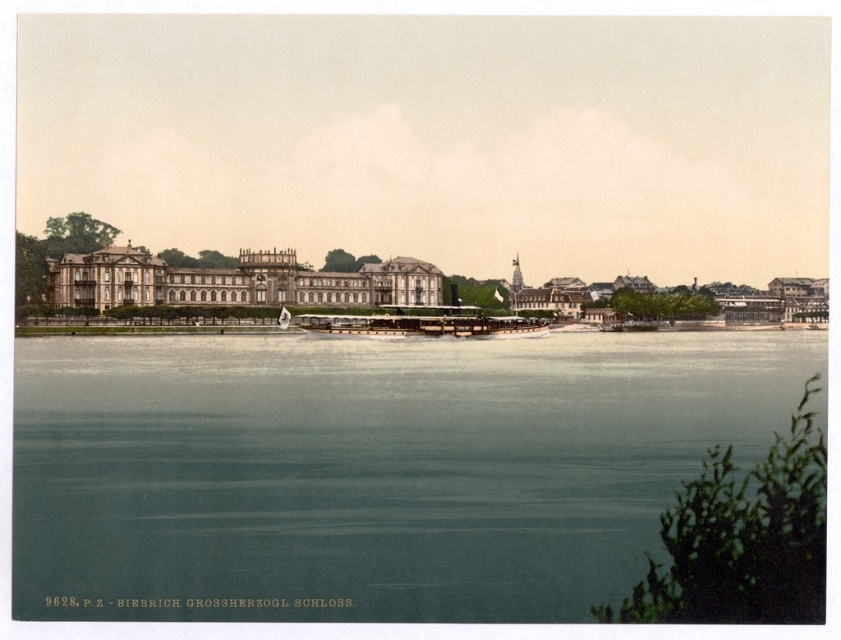
Is beige stone palace at center further to the viewer compared to wooden polished boat at center?

No, beige stone palace at center is in front of wooden polished boat at center.

How far apart are beige stone palace at center and wooden polished boat at center?

A distance of 10.85 meters exists between beige stone palace at center and wooden polished boat at center.

Between point (98, 273) and point (466, 333), which one is positioned behind?

The point (466, 333) is behind.

Find the location of a particular element. Image resolution: width=841 pixels, height=640 pixels. beige stone palace at center is located at coordinates (236, 282).

The width and height of the screenshot is (841, 640). What are the coordinates of `blue-green water at center` in the screenshot? It's located at (369, 468).

Is point (422, 547) closer to camera compared to point (464, 333)?

Yes, it is.

Does point (411, 424) come closer to viewer compared to point (434, 324)?

Yes, point (411, 424) is closer to viewer.

Locate an element on the screen. The image size is (841, 640). blue-green water at center is located at coordinates 369,468.

Is blue-green water at center bigger than beige stone palace at center?

Yes.

This screenshot has height=640, width=841. I want to click on blue-green water at center, so click(369, 468).